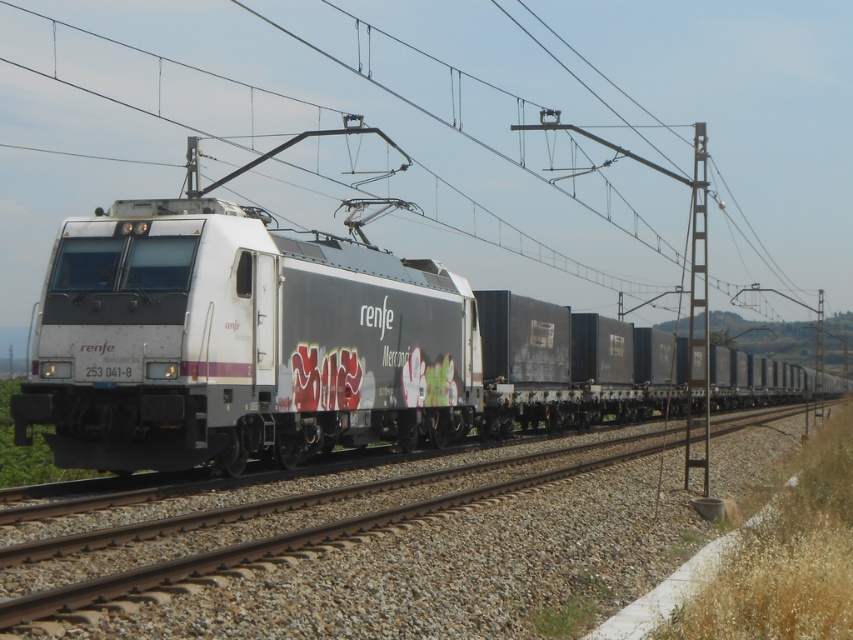
What do you see at coordinates (450, 131) in the screenshot? This screenshot has height=640, width=853. I see `metallic wire at center` at bounding box center [450, 131].

Between point (70, 188) and point (688, 358), which one is positioned behind?

The point (70, 188) is more distant.

Where is `metallic wire at center`? The width and height of the screenshot is (853, 640). metallic wire at center is located at coordinates (450, 131).

Describe the element at coordinates (450, 131) in the screenshot. I see `metallic wire at center` at that location.

Which is below, metallic wire at center or metal train tracks at center?

Positioned lower is metal train tracks at center.

At what (x,y) coordinates should I click in order to perform the action: click on metallic wire at center. Please return your answer as a coordinate pair (x, y). This screenshot has height=640, width=853. Looking at the image, I should click on (450, 131).

The image size is (853, 640). In order to click on metallic wire at center in this screenshot , I will do `click(450, 131)`.

Does metal train tracks at center come in front of metallic gray pole at right?

Yes.

Does metal train tracks at center have a greater width compared to metallic gray pole at right?

In fact, metal train tracks at center might be narrower than metallic gray pole at right.

I want to click on metal train tracks at center, so click(x=392, y=561).